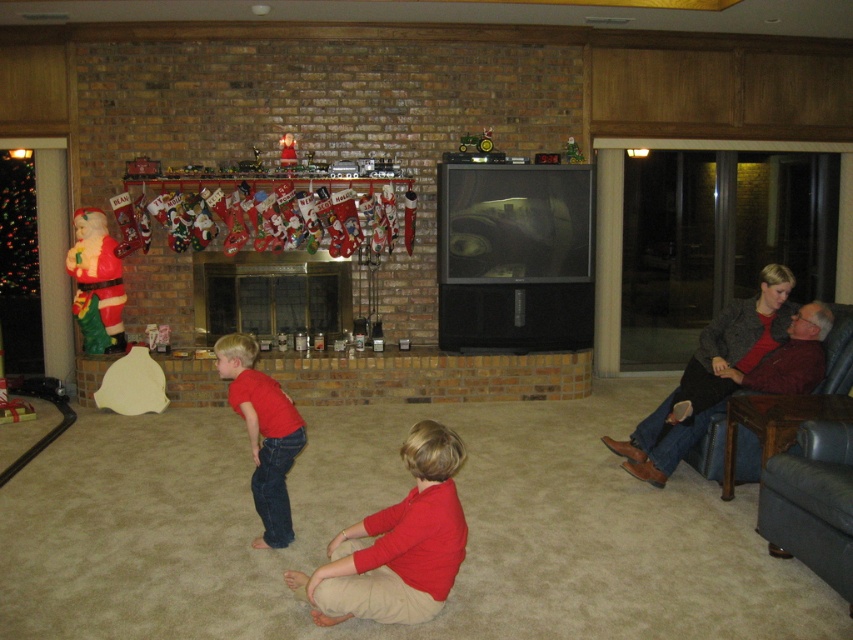
Question: Which object is positioned closest to the brick fireplace at center?

Choices:
 (A) dark gray sweater at right
 (B) red matte shirt at center

Answer: (A)

Question: From the image, what is the correct spatial relationship of matte red shirt at center in relation to plush fabric santa at left?

Choices:
 (A) above
 (B) below

Answer: (B)

Question: Estimate the real-world distances between objects in this image. Which object is closer to the dark gray sweater at right?

Choices:
 (A) brick fireplace at center
 (B) matte red shirt at center

Answer: (B)

Question: Can you confirm if matte red shirt at center is positioned below brick fireplace at center?

Choices:
 (A) no
 (B) yes

Answer: (B)

Question: Can you confirm if red matte shirt at center is positioned to the left of plush fabric santa at left?

Choices:
 (A) no
 (B) yes

Answer: (A)

Question: Which point is farther to the camera?

Choices:
 (A) (697, 371)
 (B) (334, 332)

Answer: (B)